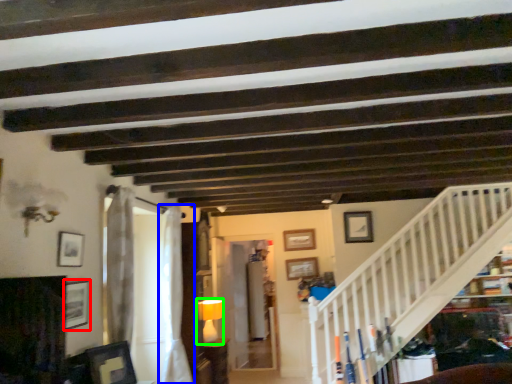
Question: Which object is positioned farthest from picture frame (highlighted by a red box)? Select from curtain (highlighted by a blue box) and lamp (highlighted by a green box).

Choices:
 (A) curtain
 (B) lamp

Answer: (B)